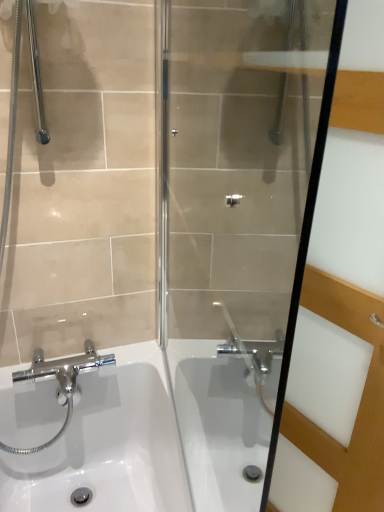
Identify the location of white glossy sink at lower left. (108, 445).

From a real-world perspective, is transparent glass screen door at center located higher than transparent glass shower door at center?

No, from a real-world perspective, transparent glass screen door at center is not on top of transparent glass shower door at center.

Could you tell me if transparent glass screen door at center is turned towards transparent glass shower door at center?

Yes, transparent glass screen door at center is turned towards transparent glass shower door at center.

Does point (366, 421) come in front of point (181, 75)?

Yes, it is in front of point (181, 75).

From the image's perspective, is white glossy sink at lower left below transparent glass screen door at center?

Yes, from the image's perspective, white glossy sink at lower left is beneath transparent glass screen door at center.

Consider the image. Which is closer, (144, 389) or (346, 319)?

Clearly, point (144, 389) is more distant from the camera than point (346, 319).

Based on the photo, who is smaller, white glossy sink at lower left or transparent glass screen door at center?

Smaller between the two is transparent glass screen door at center.

I want to click on sink that appears behind the transparent glass screen door at center, so click(x=108, y=445).

From the image's perspective, between transparent glass screen door at center and white glossy sink at lower left, who is located below?

white glossy sink at lower left.

Can you confirm if transparent glass screen door at center is thinner than white glossy sink at lower left?

Correct, the width of transparent glass screen door at center is less than that of white glossy sink at lower left.

Considering the relative sizes of transparent glass screen door at center and white glossy sink at lower left in the image provided, is transparent glass screen door at center bigger than white glossy sink at lower left?

Incorrect, transparent glass screen door at center is not larger than white glossy sink at lower left.

Identify the location of sink on the left side of transparent glass shower door at center. Image resolution: width=384 pixels, height=512 pixels. (108, 445).

Would you say white glossy sink at lower left is to the left or to the right of transparent glass shower door at center in the picture?

From the image, it's evident that white glossy sink at lower left is to the left of transparent glass shower door at center.

From their relative heights in the image, would you say white glossy sink at lower left is taller or shorter than transparent glass shower door at center?

Considering their sizes, white glossy sink at lower left has less height than transparent glass shower door at center.

Find the location of a particular element. This screenshot has height=512, width=384. sink that appears below the transparent glass shower door at center (from a real-world perspective) is located at coordinates (108, 445).

From a real-world perspective, is transparent glass shower door at center positioned under white glossy sink at lower left based on gravity?

No.

Would you say transparent glass shower door at center is a long distance from white glossy sink at lower left?

No, transparent glass shower door at center is not far from white glossy sink at lower left.

Considering their positions, is transparent glass shower door at center located in front of or behind white glossy sink at lower left?

transparent glass shower door at center is in front of white glossy sink at lower left.

Looking at this image, from a real-world perspective, is transparent glass shower door at center positioned above or below transparent glass screen door at center?

transparent glass shower door at center is above transparent glass screen door at center.

Can you confirm if transparent glass shower door at center is bigger than transparent glass screen door at center?

Incorrect, transparent glass shower door at center is not larger than transparent glass screen door at center.

Image resolution: width=384 pixels, height=512 pixels. What are the coordinates of `shower door in front of the transparent glass screen door at center` in the screenshot? It's located at (242, 157).

Find the location of `sink below the transparent glass screen door at center (from the image's perspective)`. sink below the transparent glass screen door at center (from the image's perspective) is located at coordinates (108, 445).

Estimate the real-world distances between objects in this image. Which object is closer to transparent glass shower door at center, transparent glass screen door at center or white glossy sink at lower left?

transparent glass screen door at center lies closer to transparent glass shower door at center than the other object.

Looking at the image, which one is located further to white glossy sink at lower left, transparent glass screen door at center or transparent glass shower door at center?

The object further to white glossy sink at lower left is transparent glass screen door at center.

When comparing their distances from white glossy sink at lower left, does transparent glass shower door at center or transparent glass screen door at center seem further?

Among the two, transparent glass screen door at center is located further to white glossy sink at lower left.

Which object lies nearer to the anchor point transparent glass screen door at center, transparent glass shower door at center or white glossy sink at lower left?

Among the two, transparent glass shower door at center is located nearer to transparent glass screen door at center.

Looking at this image, looking at the image, which one is located closer to transparent glass screen door at center, white glossy sink at lower left or transparent glass shower door at center?

transparent glass shower door at center lies closer to transparent glass screen door at center than the other object.

From the image, which object appears to be farther from transparent glass shower door at center, white glossy sink at lower left or transparent glass screen door at center?

The object further to transparent glass shower door at center is white glossy sink at lower left.

Locate an element on the screen. screen door between transparent glass shower door at center and white glossy sink at lower left vertically is located at coordinates click(342, 300).